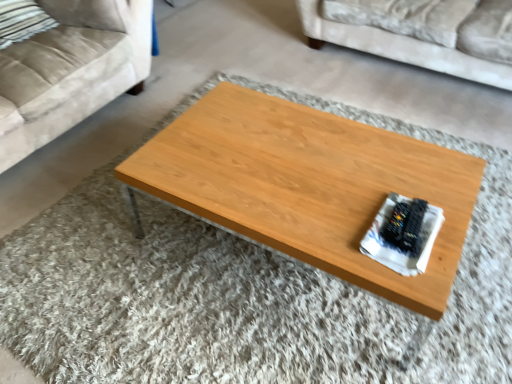
Question: Is beige fabric pillow at upper left, the first pillow viewed from the right, next to striped fabric pillow at upper left, which ranks as the second pillow in right-to-left order?

Choices:
 (A) no
 (B) yes

Answer: (A)

Question: Can you confirm if beige fabric pillow at upper left, which is counted as the second pillow, starting from the left, is positioned to the left of striped fabric pillow at upper left, arranged as the 1th pillow when viewed from the left?

Choices:
 (A) no
 (B) yes

Answer: (A)

Question: Is beige fabric pillow at upper left, the first pillow viewed from the right, positioned behind striped fabric pillow at upper left, which ranks as the second pillow in right-to-left order?

Choices:
 (A) no
 (B) yes

Answer: (B)

Question: Is beige fabric pillow at upper left, which is counted as the second pillow, starting from the left, not close to striped fabric pillow at upper left, arranged as the 1th pillow when viewed from the left?

Choices:
 (A) yes
 (B) no

Answer: (B)

Question: Is beige fabric pillow at upper left, which is counted as the second pillow, starting from the left, aimed at striped fabric pillow at upper left, arranged as the 1th pillow when viewed from the left?

Choices:
 (A) no
 (B) yes

Answer: (A)

Question: Considering the relative sizes of beige fabric pillow at upper left, which is counted as the second pillow, starting from the left, and striped fabric pillow at upper left, arranged as the 1th pillow when viewed from the left, in the image provided, is beige fabric pillow at upper left, which is counted as the second pillow, starting from the left, wider than striped fabric pillow at upper left, arranged as the 1th pillow when viewed from the left,?

Choices:
 (A) no
 (B) yes

Answer: (B)

Question: Can you confirm if suede beige couch at upper left, which appears as the 1th studio couch when viewed from the left, is positioned to the right of woodenmaterial/texturecoffee table at center?

Choices:
 (A) yes
 (B) no

Answer: (B)

Question: Can woodenmaterial/texturecoffee table at center be found inside suede beige couch at upper left, which appears as the 2th studio couch when viewed from the right?

Choices:
 (A) no
 (B) yes

Answer: (A)

Question: Considering the relative positions of suede beige couch at upper left, which appears as the 1th studio couch when viewed from the left, and woodenmaterial/texturecoffee table at center in the image provided, is suede beige couch at upper left, which appears as the 1th studio couch when viewed from the left, to the left of woodenmaterial/texturecoffee table at center from the viewer's perspective?

Choices:
 (A) no
 (B) yes

Answer: (B)

Question: Does suede beige couch at upper left, which appears as the 2th studio couch when viewed from the right, have a larger size compared to woodenmaterial/texturecoffee table at center?

Choices:
 (A) yes
 (B) no

Answer: (A)

Question: Considering the relative sizes of suede beige couch at upper left, which appears as the 2th studio couch when viewed from the right, and woodenmaterial/texturecoffee table at center in the image provided, is suede beige couch at upper left, which appears as the 2th studio couch when viewed from the right, wider than woodenmaterial/texturecoffee table at center?

Choices:
 (A) no
 (B) yes

Answer: (B)

Question: Considering the relative sizes of suede beige couch at upper left, which appears as the 1th studio couch when viewed from the left, and woodenmaterial/texturecoffee table at center in the image provided, is suede beige couch at upper left, which appears as the 1th studio couch when viewed from the left, shorter than woodenmaterial/texturecoffee table at center?

Choices:
 (A) yes
 (B) no

Answer: (B)

Question: Can you confirm if beige fabric pillow at upper left, which is counted as the second pillow, starting from the left, is positioned to the left of woodenmaterial/texturecoffee table at center?

Choices:
 (A) no
 (B) yes

Answer: (B)